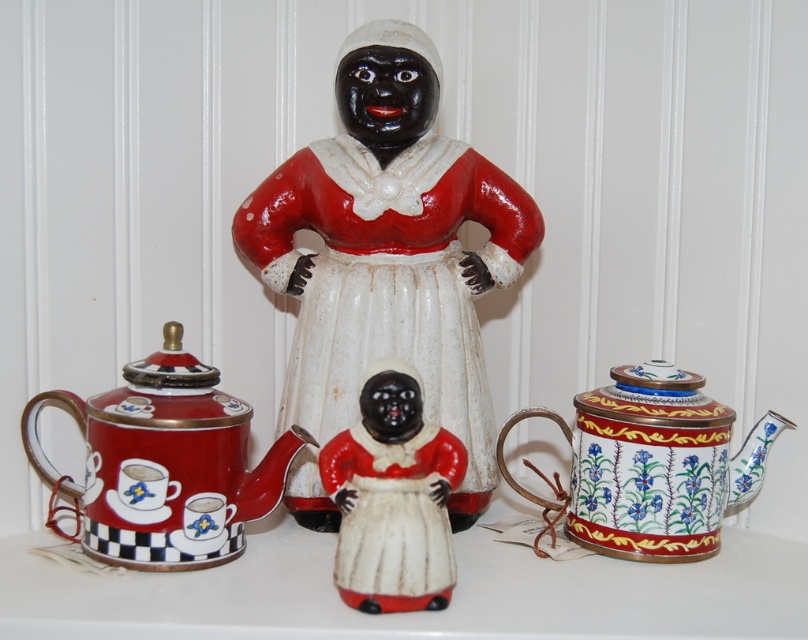
Who is higher up, matte red teapot at left or enamel floral teapot at right?

matte red teapot at left

Between matte red teapot at left and enamel floral teapot at right, which one is positioned lower?

enamel floral teapot at right

Who is more distant from viewer, (247, 515) or (689, 497)?

Point (689, 497)

Identify the location of matte red teapot at left. (165, 464).

Is matte red teapot at left wider than matte porcelain doll at center?

Indeed, matte red teapot at left has a greater width compared to matte porcelain doll at center.

Where is `matte red teapot at left`? The width and height of the screenshot is (808, 640). matte red teapot at left is located at coordinates (165, 464).

Is matte ceramic figure at center above matte porcelain doll at center?

Indeed, matte ceramic figure at center is positioned over matte porcelain doll at center.

Does matte ceramic figure at center appear under matte porcelain doll at center?

No.

Identify the location of matte ceramic figure at center. This screenshot has height=640, width=808. (389, 250).

Identify the location of matte ceramic figure at center. The height and width of the screenshot is (640, 808). (389, 250).